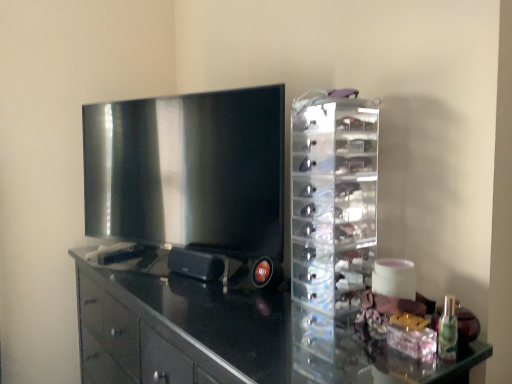
Question: From a real-world perspective, is matte black tv at left physically below transparent acrylic organizer at right?

Choices:
 (A) yes
 (B) no

Answer: (B)

Question: Does matte black tv at left have a lesser height compared to transparent acrylic organizer at right?

Choices:
 (A) yes
 (B) no

Answer: (B)

Question: Is matte black tv at left oriented away from transparent acrylic organizer at right?

Choices:
 (A) no
 (B) yes

Answer: (A)

Question: From the image's perspective, is matte black tv at left on transparent acrylic organizer at right?

Choices:
 (A) yes
 (B) no

Answer: (A)

Question: Can you confirm if matte black tv at left is taller than transparent acrylic organizer at right?

Choices:
 (A) yes
 (B) no

Answer: (A)

Question: Considering the positions of glossy black cabinet at center and transparent acrylic organizer at right in the image, is glossy black cabinet at center taller or shorter than transparent acrylic organizer at right?

Choices:
 (A) short
 (B) tall

Answer: (B)

Question: From a real-world perspective, is glossy black cabinet at center above or below transparent acrylic organizer at right?

Choices:
 (A) above
 (B) below

Answer: (B)

Question: Which is correct: glossy black cabinet at center is inside transparent acrylic organizer at right, or outside of it?

Choices:
 (A) inside
 (B) outside

Answer: (B)

Question: In the image, is glossy black cabinet at center on the left side or the right side of transparent acrylic organizer at right?

Choices:
 (A) left
 (B) right

Answer: (A)

Question: From their relative heights in the image, would you say transparent acrylic organizer at right is taller or shorter than matte black tv at left?

Choices:
 (A) short
 (B) tall

Answer: (A)

Question: Is point (352, 316) positioned closer to the camera than point (161, 119)?

Choices:
 (A) closer
 (B) farther

Answer: (A)

Question: Visually, is transparent acrylic organizer at right positioned to the left or to the right of matte black tv at left?

Choices:
 (A) right
 (B) left

Answer: (A)

Question: Based on their sizes in the image, would you say transparent acrylic organizer at right is bigger or smaller than matte black tv at left?

Choices:
 (A) big
 (B) small

Answer: (B)

Question: Considering the positions of glossy black cabinet at center and matte black tv at left in the image, is glossy black cabinet at center bigger or smaller than matte black tv at left?

Choices:
 (A) small
 (B) big

Answer: (B)

Question: Considering the positions of glossy black cabinet at center and matte black tv at left in the image, is glossy black cabinet at center wider or thinner than matte black tv at left?

Choices:
 (A) wide
 (B) thin

Answer: (A)